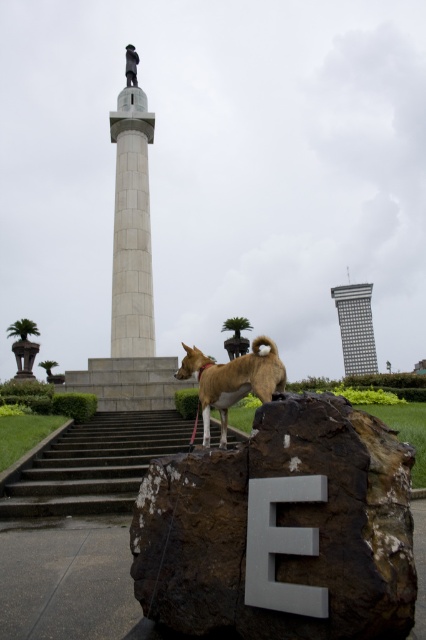
Question: Which object is positioned farthest from the golden fur dog at center?

Choices:
 (A) green leafy palm tree at lower left
 (B) white marble column at upper center
 (C) dark gray concrete stairs at lower left

Answer: (A)

Question: Which object is the closest to the white marble statue at center?

Choices:
 (A) polished bronze statue at upper center
 (B) dark gray concrete stairs at lower left
 (C) brown rough rock at center
 (D) gray metallic tower at center

Answer: (A)

Question: Is dark gray concrete stairs at lower left thinner than green leafy palm tree at lower left?

Choices:
 (A) no
 (B) yes

Answer: (B)

Question: Considering the relative positions of dark gray concrete stairs at lower left and gray metallic tower at center in the image provided, where is dark gray concrete stairs at lower left located with respect to gray metallic tower at center?

Choices:
 (A) right
 (B) left

Answer: (B)

Question: Among these points, which one is farthest from the camera?

Choices:
 (A) (x=368, y=563)
 (B) (x=127, y=65)
 (C) (x=17, y=360)

Answer: (C)

Question: Is white marble statue at center positioned in front of polished bronze statue at upper center?

Choices:
 (A) no
 (B) yes

Answer: (B)